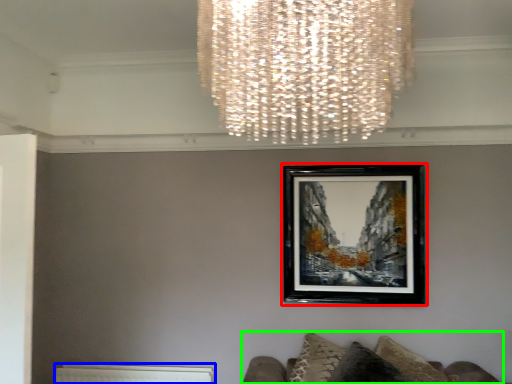
Question: Which is farther away from picture frame (highlighted by a red box)? radiator (highlighted by a blue box) or furniture (highlighted by a green box)?

Choices:
 (A) radiator
 (B) furniture

Answer: (A)